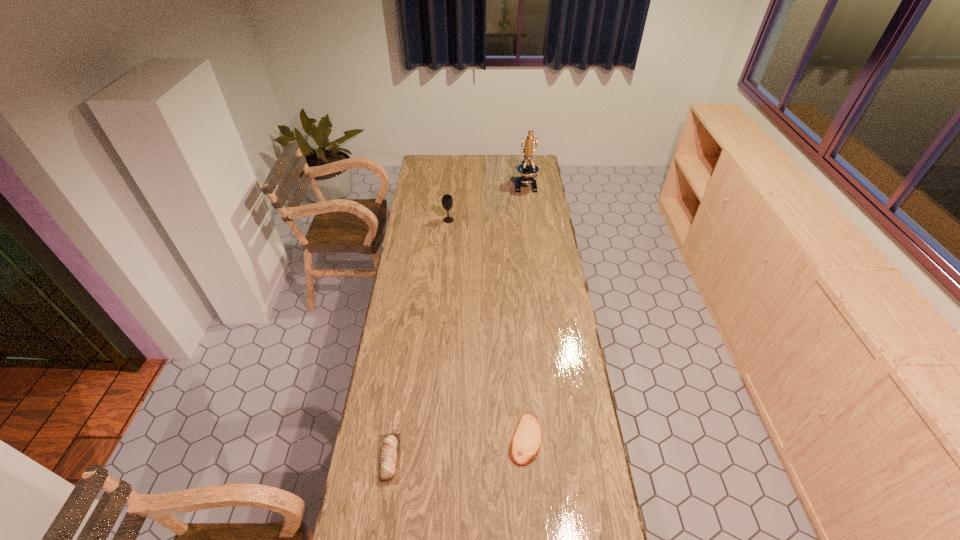
Locate an element on the screen. microscope is located at coordinates (527, 169).

Where is `the tallest object`? the tallest object is located at coordinates (527, 169).

Where is `the second object from left to right`? This screenshot has height=540, width=960. the second object from left to right is located at coordinates (447, 202).

Locate an element on the screen. The width and height of the screenshot is (960, 540). wineglass is located at coordinates click(447, 202).

Where is `the second shortest object`? Image resolution: width=960 pixels, height=540 pixels. the second shortest object is located at coordinates (389, 454).

The image size is (960, 540). I want to click on the left pita bread, so click(389, 454).

Find the location of a particular element. the shorter pita bread is located at coordinates (526, 442).

Find the location of a particular element. the shortest object is located at coordinates (526, 442).

Identify the location of free spot located at the eyepiece of the farthest object. This screenshot has width=960, height=540. (533, 239).

In order to click on blank space located 0.060m on the right of the third object from right to left in this screenshot , I will do click(x=466, y=220).